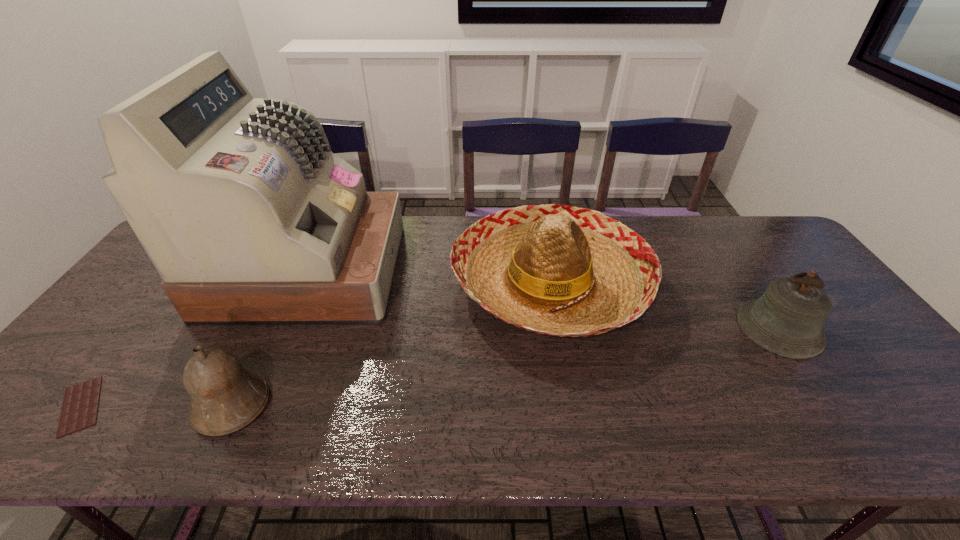
Where is `free space at the near edge of the desktop`? free space at the near edge of the desktop is located at coordinates (618, 439).

The image size is (960, 540). In the image, there is a desktop. Find the location of `vacant region at the left edge`. vacant region at the left edge is located at coordinates (109, 321).

What are the coordinates of `vacant space at the right edge of the desktop` in the screenshot? It's located at (785, 261).

This screenshot has width=960, height=540. What are the coordinates of `vacant region at the near left corner of the desktop` in the screenshot? It's located at coord(49,433).

Where is `vacant area between the right bell and the nearer bell`? vacant area between the right bell and the nearer bell is located at coordinates (506, 367).

This screenshot has width=960, height=540. I want to click on empty location between the sombrero and the leftmost object, so click(315, 345).

The width and height of the screenshot is (960, 540). Find the location of `free space that is in between the sombrero and the leftmost object`. free space that is in between the sombrero and the leftmost object is located at coordinates tap(315, 345).

What are the coordinates of `vacant point located between the chocolate bar and the tallest object` in the screenshot? It's located at (194, 338).

Identify the location of vacant region between the rightmost object and the sombrero. (664, 306).

Identify the location of vacant area that lies between the sombrero and the farther bell. This screenshot has height=540, width=960. (664, 306).